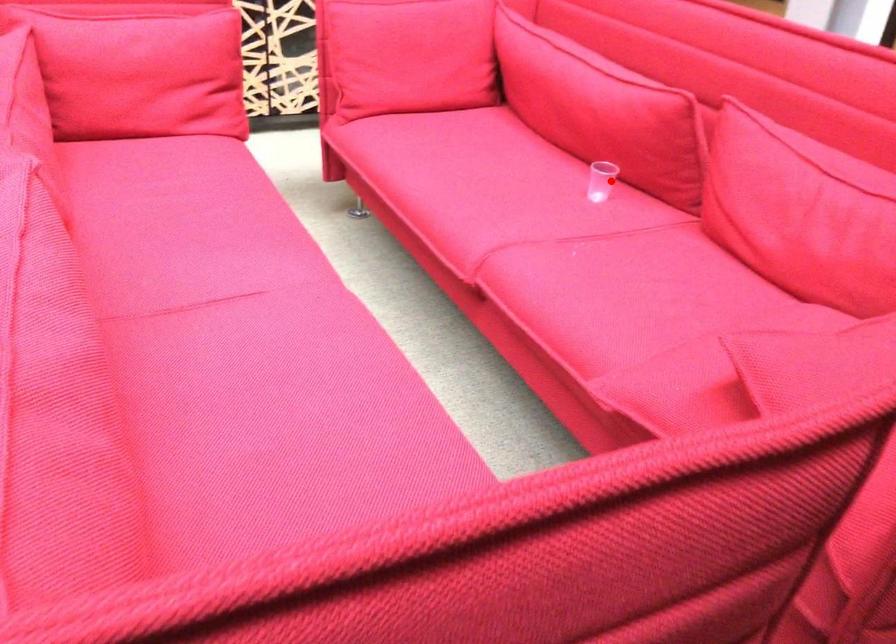
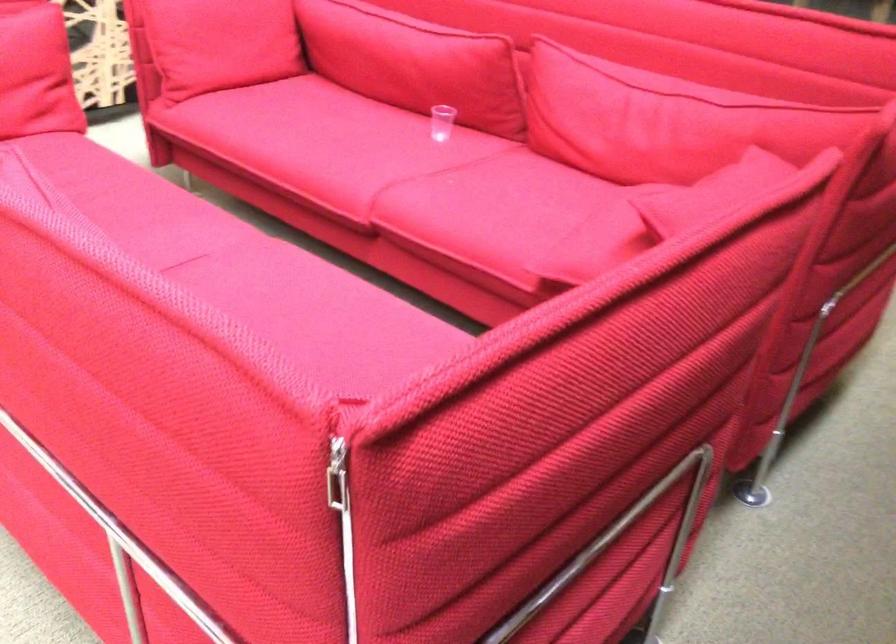
Question: I am providing you with two images of the same scene from different viewpoints. Given a red point in image1, look at the same physical point in image2. Is it:

Choices:
 (A) Closer to the viewpoint
 (B) Farther from the viewpoint

Answer: (B)